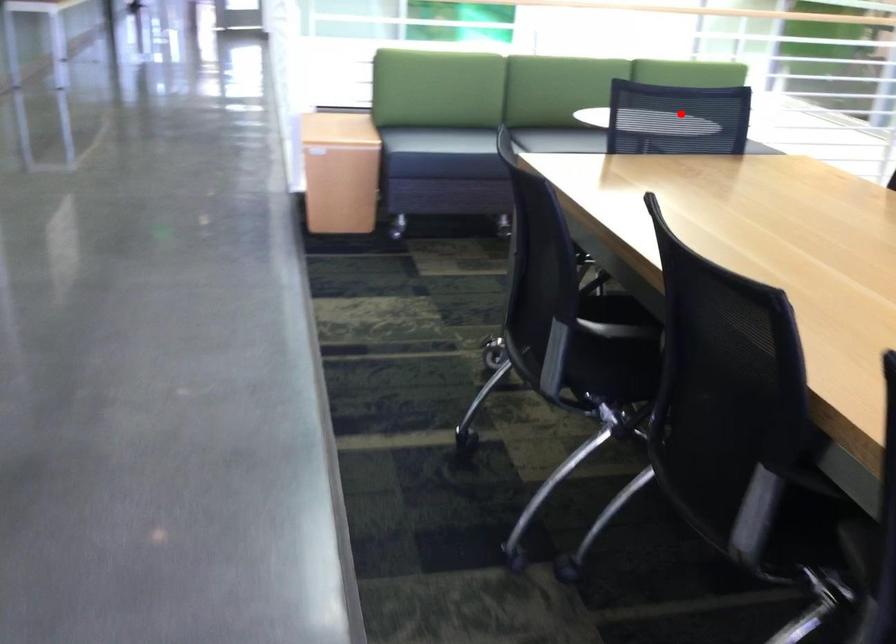
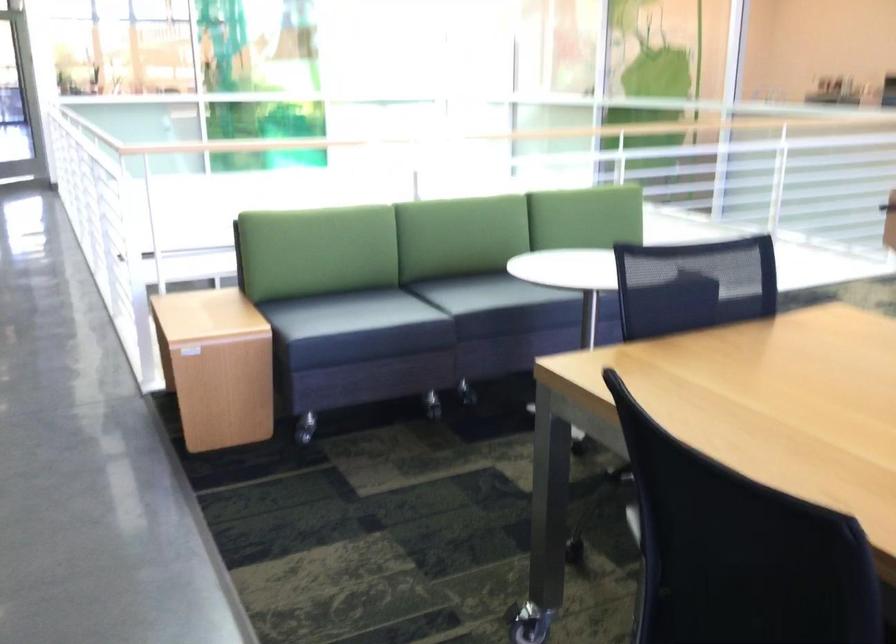
The point at the highlighted location is marked in the first image. Where is the corresponding point in the second image?

(695, 275)